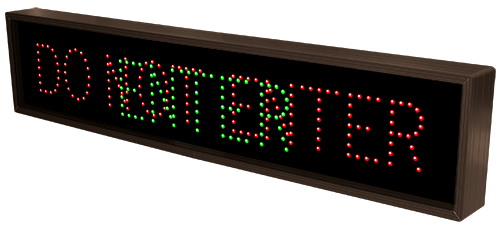
The width and height of the screenshot is (500, 229). I want to click on red lights (circles), so click(45, 92).